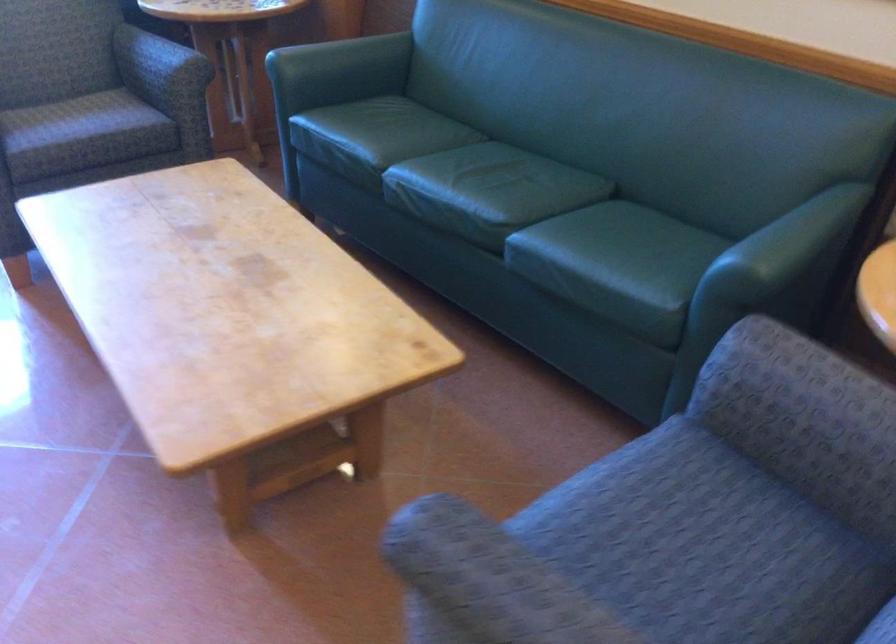
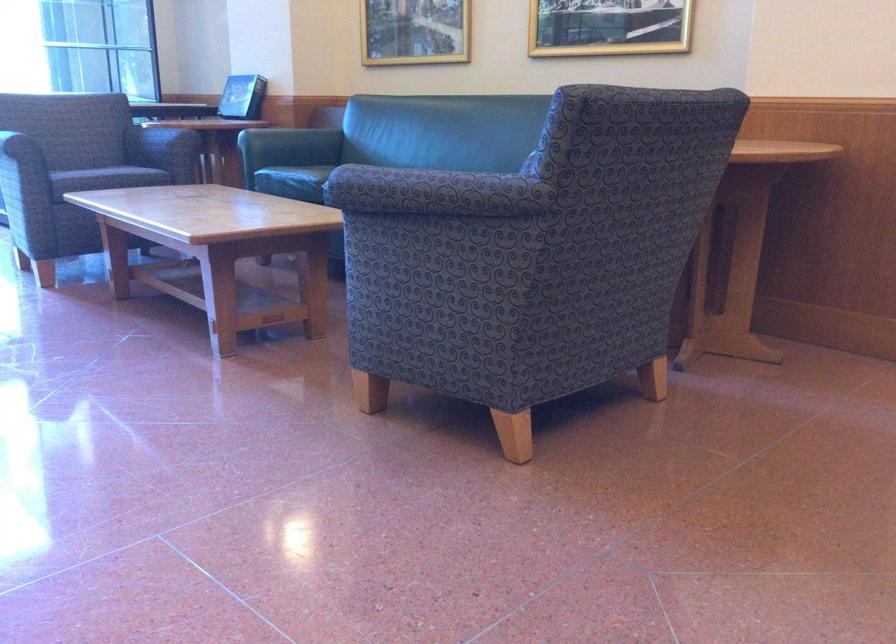
In the second image, find the point that corresponds to point (99, 145) in the first image.

(115, 176)